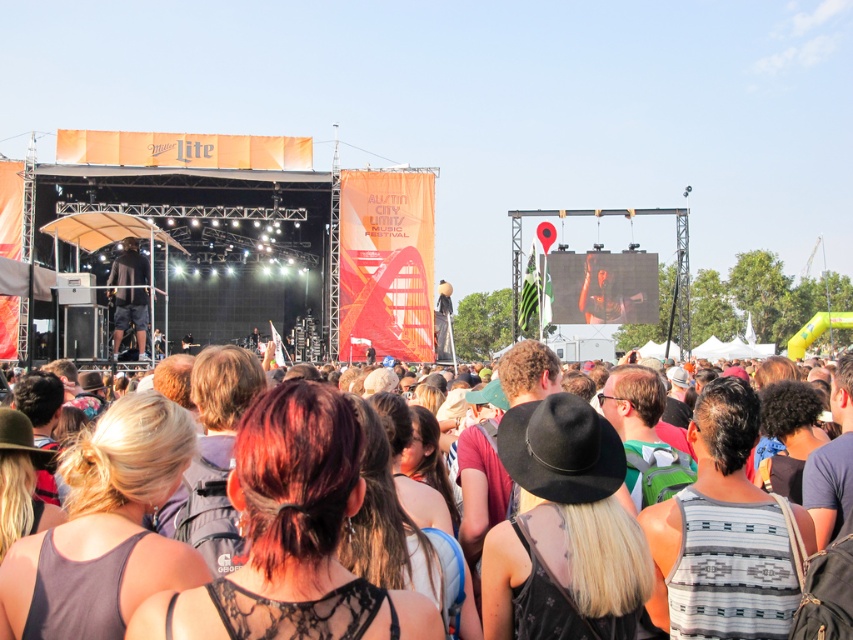
Between multicolored fabric crowd at center and black matte shirt at center, which one has less height?

black matte shirt at center

Does multicolored fabric crowd at center appear on the right side of black matte shirt at center?

Correct, you'll find multicolored fabric crowd at center to the right of black matte shirt at center.

What do you see at coordinates (712, 504) in the screenshot? I see `multicolored fabric crowd at center` at bounding box center [712, 504].

You are a GUI agent. You are given a task and a screenshot of the screen. Output one action in this format:
    pyautogui.click(x=<x>, y=<y>)
    Task: Click on the multicolored fabric crowd at center
    The height and width of the screenshot is (640, 853).
    Given the screenshot: What is the action you would take?
    pyautogui.click(x=712, y=504)